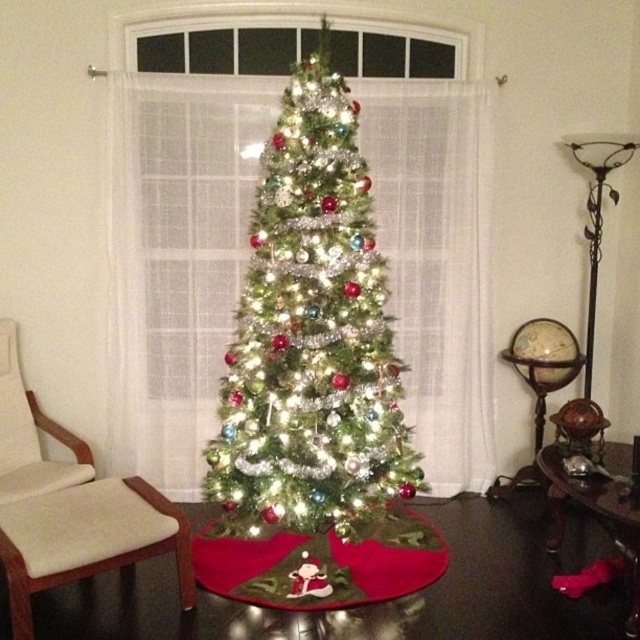
Question: Among these objects, which one is farthest from the camera?

Choices:
 (A) light brown wooden stool at lower left
 (B) iridescent shiny tree at center

Answer: (B)

Question: Can you confirm if iridescent shiny tree at center is bigger than light brown wooden stool at lower left?

Choices:
 (A) yes
 (B) no

Answer: (A)

Question: Which of the following is the farthest from the observer?

Choices:
 (A) (28, 563)
 (B) (323, 264)

Answer: (B)

Question: Can you confirm if iridescent shiny tree at center is positioned to the left of light brown wooden stool at lower left?

Choices:
 (A) yes
 (B) no

Answer: (B)

Question: Which point is farther to the camera?

Choices:
 (A) (278, 266)
 (B) (45, 568)

Answer: (A)

Question: Can you confirm if iridescent shiny tree at center is smaller than light brown wooden stool at lower left?

Choices:
 (A) yes
 (B) no

Answer: (B)